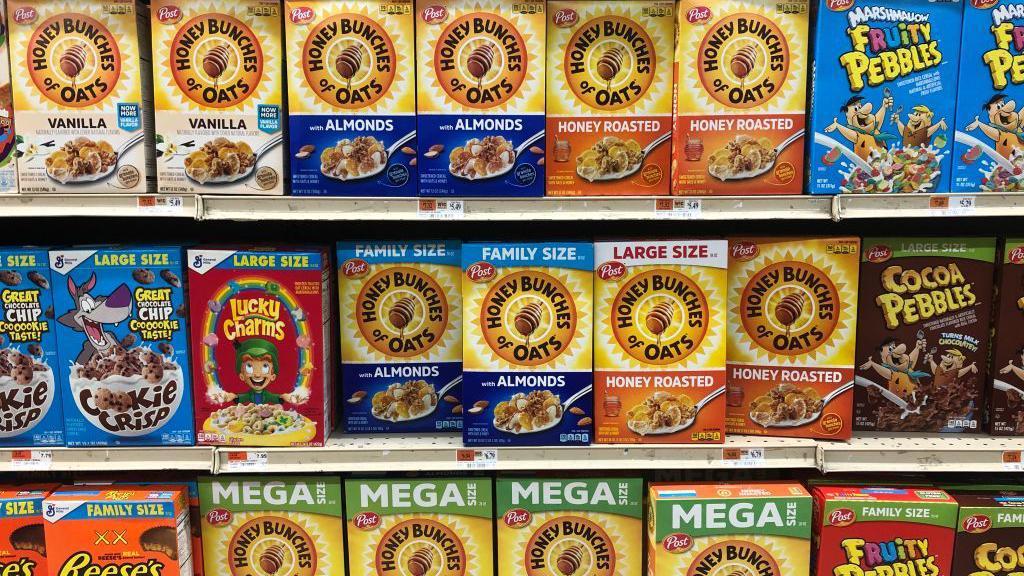
Where is `bowls of cereal`? Image resolution: width=1024 pixels, height=576 pixels. bowls of cereal is located at coordinates (23, 400), (161, 393), (234, 418), (927, 412), (906, 169), (990, 180).